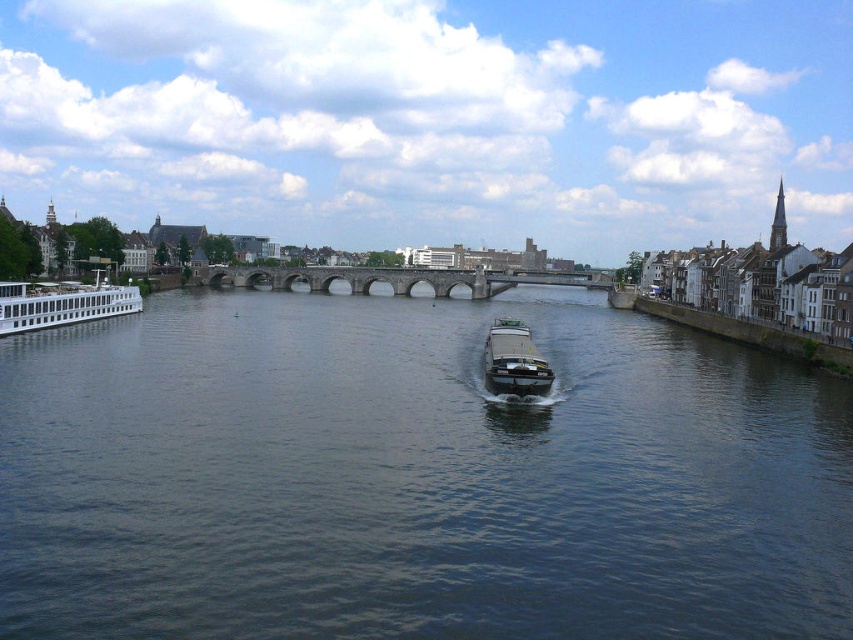
You are standing on the riverside and want to take a photo of the stone arch bridge at center and the dark blue water at center. Which object should you focus on first if you want to capture both in one frame?

You should focus on the stone arch bridge at center first because it is above the dark blue water at center, allowing both to be captured in the frame.

You are standing on the riverside and want to take a photo of the stone arch bridge at center and the white glossy cruise ship at left. Which object should you point your camera upwards to capture?

You should point your camera upwards to capture the stone arch bridge at center because it is positioned above the white glossy cruise ship at left.

You are a photographer planning to take aerial shots of the white glossy cruise ship at left and the metallic gray barge at center from a drone. You need to ensure your drone can capture both objects in one frame. Considering their heights, which object might require adjusting the camera angle to avoid being cut off?

The white glossy cruise ship at left is taller than the metallic gray barge at center, so it might require adjusting the camera angle to avoid being cut off.